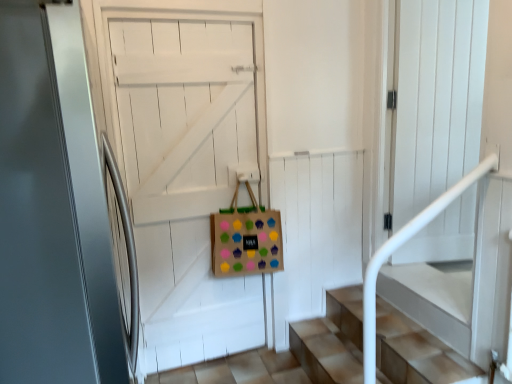
Question: Do you think satin white door at center, positioned as the second door in back-to-front order, is within brown paper bag with colorful cupcake stickers at center, or outside of it?

Choices:
 (A) inside
 (B) outside

Answer: (B)

Question: From a real-world perspective, relative to brown paper bag with colorful cupcake stickers at center, is satin white door at center, positioned as the second door in back-to-front order, vertically above or below?

Choices:
 (A) below
 (B) above

Answer: (B)

Question: Which of these objects is positioned farthest from the wooden door at center, the second door from the front?

Choices:
 (A) brown paper bag with colorful cupcake stickers at center
 (B) satin white door at center, positioned as the second door in back-to-front order

Answer: (B)

Question: Estimate the real-world distances between objects in this image. Which object is farther from the wooden door at center, arranged as the 1th door when viewed from the back?

Choices:
 (A) brown paper bag with colorful cupcake stickers at center
 (B) satin white door at center, marked as the 1th door in a front-to-back arrangement

Answer: (B)